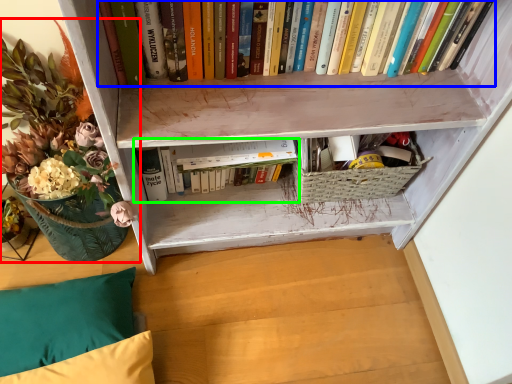
Question: Based on their relative distances, which object is farther from floral arrangement (highlighted by a red box)? Choose from book (highlighted by a blue box) and book (highlighted by a green box).

Choices:
 (A) book
 (B) book

Answer: (A)